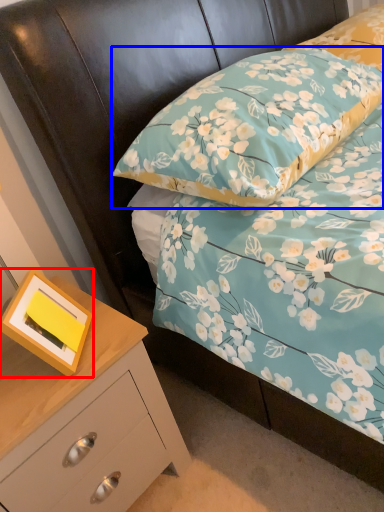
Question: Which object appears farthest to the camera in this image, picture frame (highlighted by a red box) or pillow (highlighted by a blue box)?

Choices:
 (A) picture frame
 (B) pillow

Answer: (A)